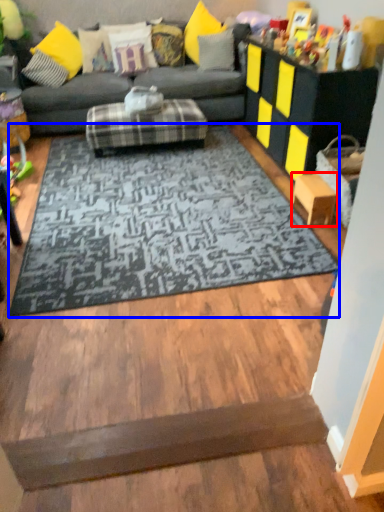
Question: Among these objects, which one is farthest to the camera, stool (highlighted by a red box) or mat (highlighted by a blue box)?

Choices:
 (A) stool
 (B) mat

Answer: (A)